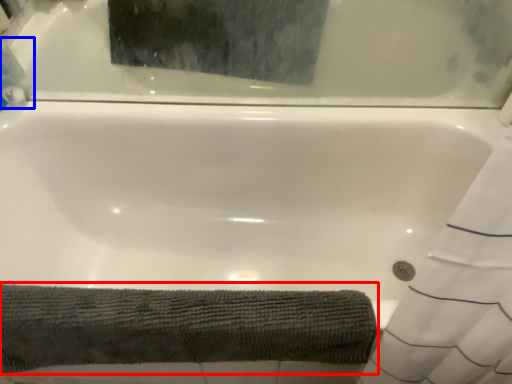
Question: Among these objects, which one is farthest to the camera, bath towel (highlighted by a red box) or cleaning product (highlighted by a blue box)?

Choices:
 (A) bath towel
 (B) cleaning product

Answer: (B)